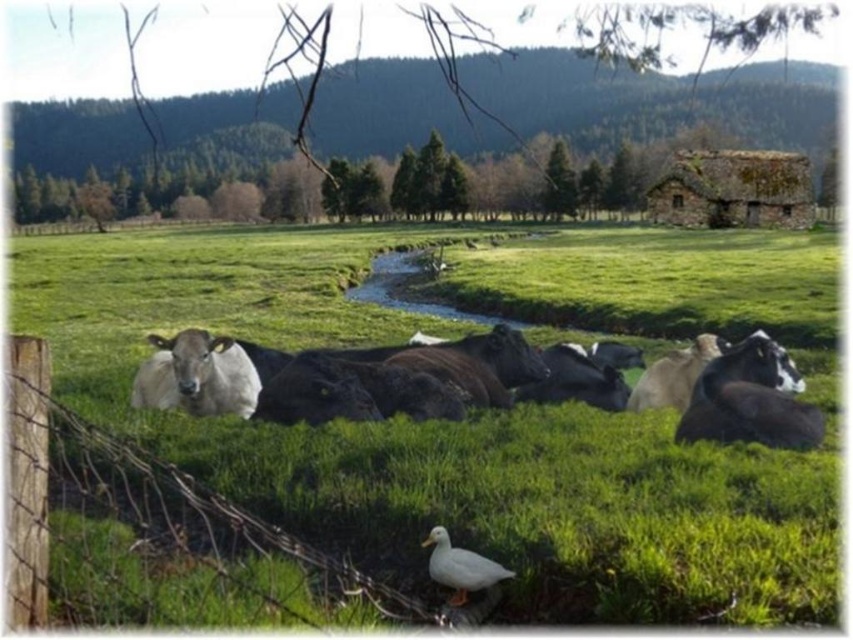
Is white woolly sheep at lower left smaller than white matte duck at lower center?

No, white woolly sheep at lower left is not smaller than white matte duck at lower center.

Is point (190, 406) in front of point (480, 566)?

No, (190, 406) is behind (480, 566).

Does point (148, 339) lie in front of point (477, 554)?

No, (148, 339) is further to viewer.

Image resolution: width=853 pixels, height=640 pixels. What are the coordinates of `white woolly sheep at lower left` in the screenshot? It's located at (196, 376).

Does green grassy at center appear over white matte duck at lower center?

Yes.

Between green grassy at center and white matte duck at lower center, which one is positioned higher?

Positioned higher is green grassy at center.

Is point (758, 540) farther from viewer compared to point (451, 566)?

Yes.

Locate an element on the screen. Image resolution: width=853 pixels, height=640 pixels. green grassy at center is located at coordinates (440, 438).

Does point (396, 429) come behind point (175, 340)?

No, (396, 429) is in front of (175, 340).

Between green grassy at center and white woolly sheep at lower left, which one has less height?

With less height is white woolly sheep at lower left.

At what (x,y) coordinates should I click in order to perform the action: click on green grassy at center. Please return your answer as a coordinate pair (x, y). Looking at the image, I should click on (440, 438).

Where is `green grassy at center`? This screenshot has width=853, height=640. green grassy at center is located at coordinates (440, 438).